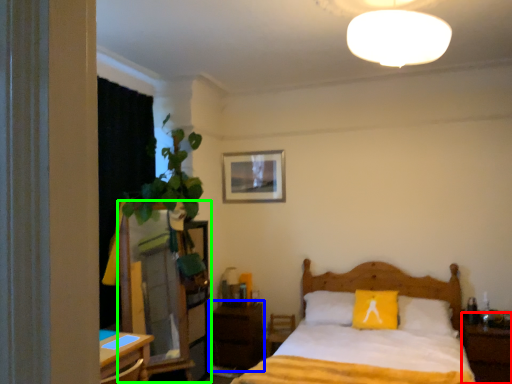
Question: Considering the real-world distances, which object is closest to nightstand (highlighted by a red box)? nightstand (highlighted by a blue box) or dresser (highlighted by a green box).

Choices:
 (A) nightstand
 (B) dresser

Answer: (A)